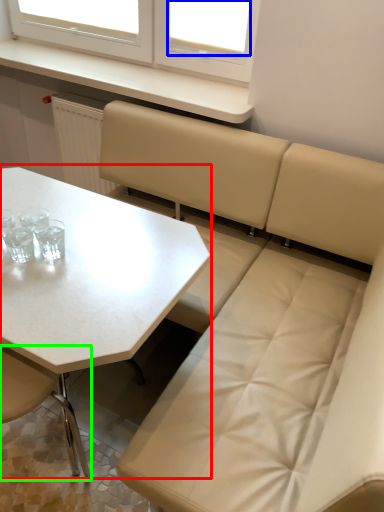
Question: Considering the real-world distances, which object is farthest from table (highlighted by a red box)? window screen (highlighted by a blue box) or chair (highlighted by a green box)?

Choices:
 (A) window screen
 (B) chair

Answer: (A)